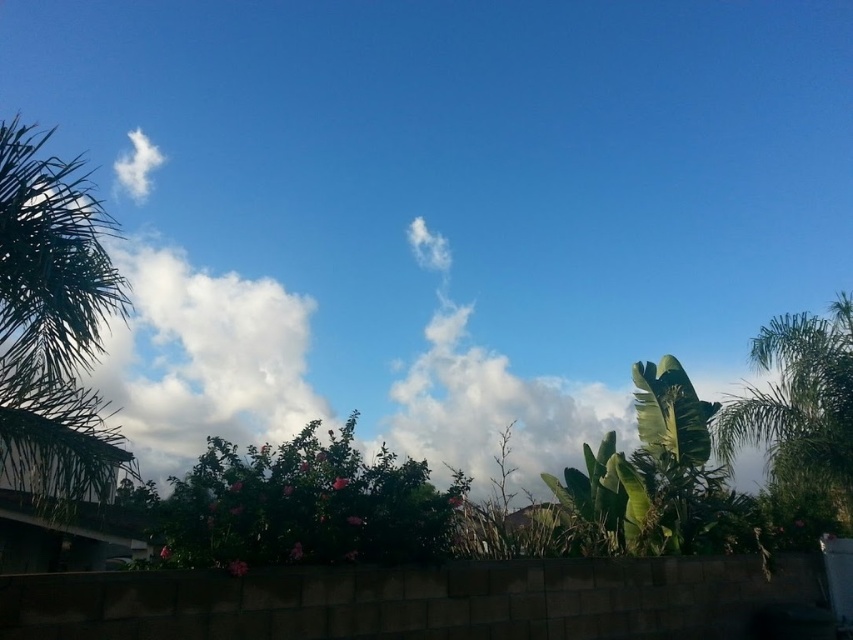
Which is more to the right, green leafy bush at center or green leafy palm tree at right?

From the viewer's perspective, green leafy palm tree at right appears more on the right side.

Where is `green leafy bush at center`? green leafy bush at center is located at coordinates (305, 506).

The image size is (853, 640). Identify the location of green leafy bush at center. (305, 506).

In order to click on green leafy bush at center in this screenshot , I will do `click(305, 506)`.

Between green leafy palm tree at left and green leafy bush at center, which one is positioned higher?

green leafy palm tree at left

Between green leafy palm tree at left and green leafy bush at center, which one appears on the left side from the viewer's perspective?

From the viewer's perspective, green leafy palm tree at left appears more on the left side.

What do you see at coordinates (53, 323) in the screenshot?
I see `green leafy palm tree at left` at bounding box center [53, 323].

Where is `green leafy palm tree at left`? green leafy palm tree at left is located at coordinates (53, 323).

Who is positioned more to the right, green leafy palm tree at left or green leafy palm tree at right?

green leafy palm tree at right

What do you see at coordinates (53, 323) in the screenshot? This screenshot has width=853, height=640. I see `green leafy palm tree at left` at bounding box center [53, 323].

Find the location of a particular element. This screenshot has height=640, width=853. green leafy palm tree at left is located at coordinates (53, 323).